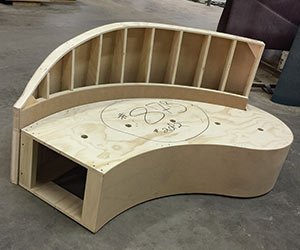
The width and height of the screenshot is (300, 250). I want to click on wall, so click(x=242, y=12).